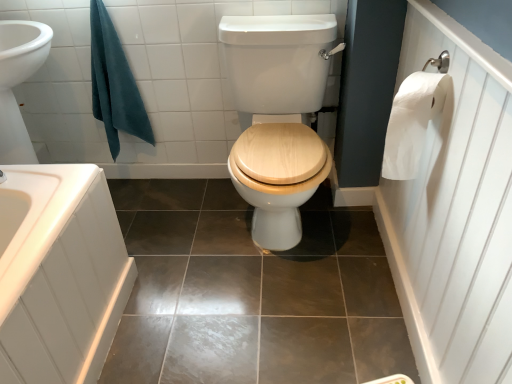
Question: Should I look upward or downward to see shiny brown tile at center?

Choices:
 (A) down
 (B) up

Answer: (A)

Question: Is white paper towel at right shorter than shiny brown tile at center?

Choices:
 (A) no
 (B) yes

Answer: (A)

Question: From the image's perspective, would you say white paper towel at right is shown under shiny brown tile at center?

Choices:
 (A) no
 (B) yes

Answer: (A)

Question: Is white paper towel at right positioned in front of shiny brown tile at center?

Choices:
 (A) no
 (B) yes

Answer: (B)

Question: From a real-world perspective, is white paper towel at right on top of shiny brown tile at center?

Choices:
 (A) yes
 (B) no

Answer: (A)

Question: From the image's perspective, is white paper towel at right located above shiny brown tile at center?

Choices:
 (A) yes
 (B) no

Answer: (A)

Question: Does white paper towel at right have a greater width compared to shiny brown tile at center?

Choices:
 (A) no
 (B) yes

Answer: (A)

Question: Can you confirm if shiny brown tile at center is positioned to the left of white paper towel at right?

Choices:
 (A) yes
 (B) no

Answer: (A)

Question: From the image's perspective, is shiny brown tile at center on top of white paper towel at right?

Choices:
 (A) no
 (B) yes

Answer: (A)

Question: Does shiny brown tile at center have a lesser width compared to white paper towel at right?

Choices:
 (A) no
 (B) yes

Answer: (A)

Question: Can you confirm if shiny brown tile at center is taller than white paper towel at right?

Choices:
 (A) no
 (B) yes

Answer: (A)

Question: Is the surface of shiny brown tile at center in direct contact with white paper towel at right?

Choices:
 (A) no
 (B) yes

Answer: (A)

Question: Considering the relative positions of shiny brown tile at center and white paper towel at right in the image provided, is shiny brown tile at center in front of white paper towel at right?

Choices:
 (A) yes
 (B) no

Answer: (B)

Question: Is shiny brown tile at center thinner than teal cotton towel at upper left?

Choices:
 (A) yes
 (B) no

Answer: (B)